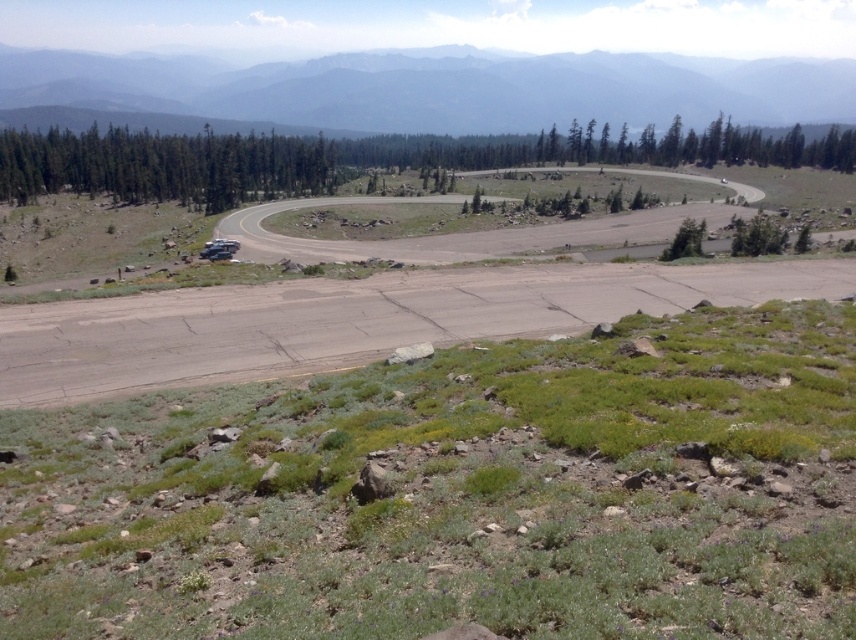
You are a hiker planning to take a photo of the dirt road at center and the gray foggy mountain at upper center. Which object will appear smaller in the photo?

The dirt road at center will appear smaller in the photo because it occupies less space than the gray foggy mountain at upper center.

You are navigating a drone that needs to fly from point A to point B. The drone has a limited battery and must avoid obstacles. Given the coordinates of point A as point [406,305] and point B as point [3,65], which point is closer to the starting position of the drone if it begins at the grassy area in the foreground?

Point [3,65] is closer to the starting position in the grassy foreground because it is located behind point [406,305], which is in front of it. Since the drone starts at the foreground, the point further back would be nearer.

You are a hiker planning to follow the dirt road at center towards the gray foggy mountain at upper center. Based on the scene, will the mountain become more visible or less visible as you walk along the road?

The dirt road at center is closer to the viewer than the gray foggy mountain at upper center. As you walk along the dirt road at center towards the mountain, the distance between you and the mountain decreases, so the mountain may become more visible if the fog dissipates, but if the fog remains, visibility might not improve significantly.